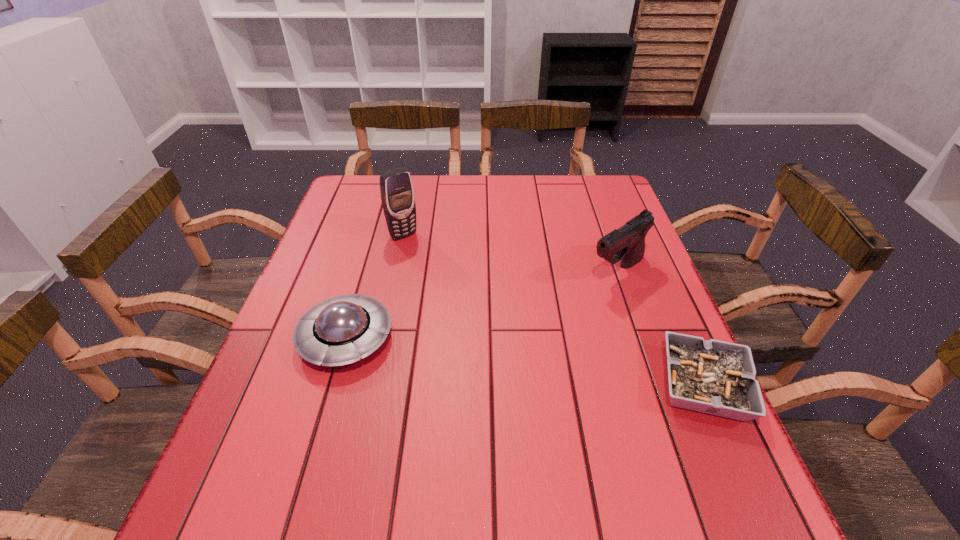
The height and width of the screenshot is (540, 960). Identify the location of vacant point located between the ashtray and the second tallest object. tap(660, 328).

At what (x,y) coordinates should I click in order to perform the action: click on free space between the third tallest object and the tallest object. Please return your answer as a coordinate pair (x, y). The image size is (960, 540). Looking at the image, I should click on (374, 286).

Locate an element on the screen. free space that is in between the ashtray and the farthest object is located at coordinates (553, 310).

Locate which object is the closest to the shortest object. Please provide its 2D coordinates. Your answer should be formatted as a tuple, i.e. [(x, y)], where the tuple contains the x and y coordinates of a point satisfying the conditions above.

[(627, 243)]

Locate which object is the second closest to the tallest object. Please provide its 2D coordinates. Your answer should be formatted as a tuple, i.e. [(x, y)], where the tuple contains the x and y coordinates of a point satisfying the conditions above.

[(627, 243)]

I want to click on vacant area in the image that satisfies the following two spatial constraints: 1. on the front side of the farthest object; 2. on the right side of the second tallest object, so click(396, 272).